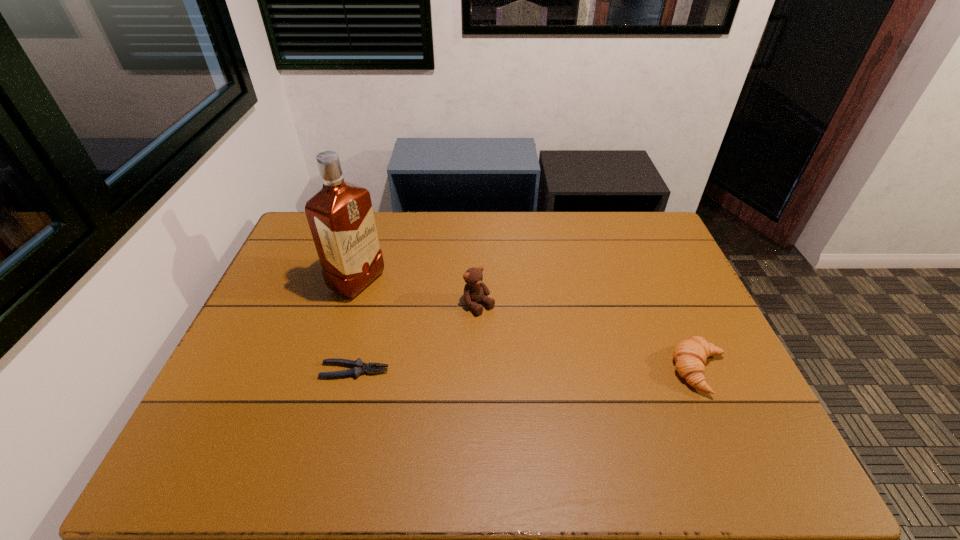
Where is `vacant region at the right edge of the desktop`? vacant region at the right edge of the desktop is located at coordinates (672, 320).

The height and width of the screenshot is (540, 960). I want to click on blank area at the far right corner, so click(x=629, y=225).

The image size is (960, 540). In order to click on vacant space at the near right corner of the desktop in this screenshot , I will do `click(691, 404)`.

I want to click on free space between the second shortest object and the third shortest object, so click(589, 338).

I want to click on unoccupied area between the tallest object and the crescent roll, so click(x=529, y=326).

You are a GUI agent. You are given a task and a screenshot of the screen. Output one action in this format:
    pyautogui.click(x=<x>, y=<y>)
    Task: Click on the free space between the third shortest object and the liquor
    
    Given the screenshot: What is the action you would take?
    pyautogui.click(x=419, y=294)

The height and width of the screenshot is (540, 960). Find the location of `vacant area between the third tallest object and the third shortest object`. vacant area between the third tallest object and the third shortest object is located at coordinates (589, 338).

Identify the location of free space between the pliers and the tallest object. (356, 326).

Image resolution: width=960 pixels, height=540 pixels. I want to click on free space between the liquor and the third object from left to right, so tap(419, 294).

This screenshot has width=960, height=540. Identify the location of vacant area that lies between the tallest object and the crescent roll. (529, 326).